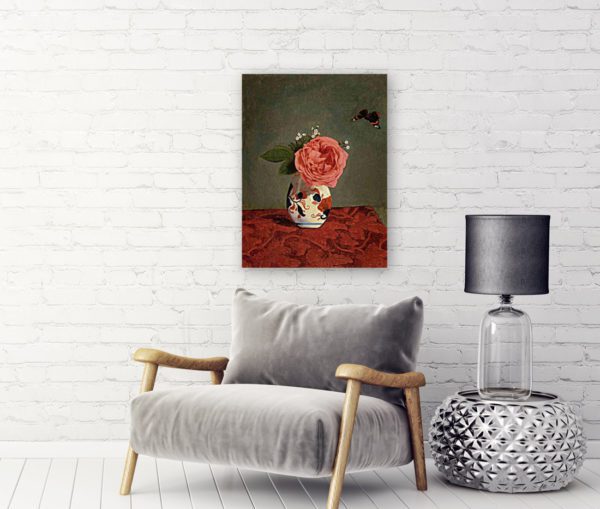
Where is `white wood plank floor`? This screenshot has height=509, width=600. white wood plank floor is located at coordinates (64, 468).